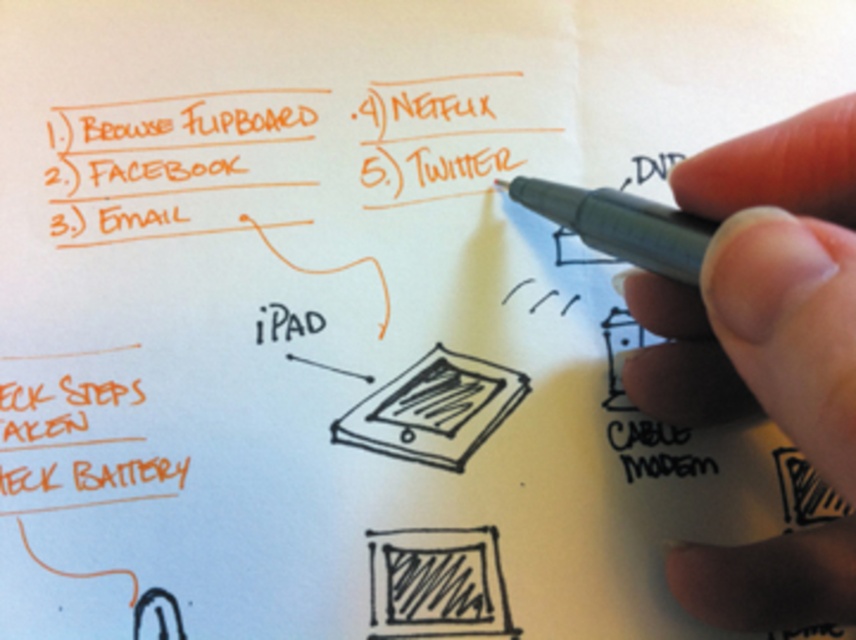
Question: Does sketchy paper tablet at center have a greater width compared to black pen at upper right?

Choices:
 (A) no
 (B) yes

Answer: (B)

Question: Does skinny pen at upper right lie behind sketchy paper tablet at center?

Choices:
 (A) yes
 (B) no

Answer: (B)

Question: Which of the following is the farthest from the observer?

Choices:
 (A) black pen at upper right
 (B) skinny pen at upper right

Answer: (A)

Question: Estimate the real-world distances between objects in this image. Which object is farther from the sketchy paper tablet at center?

Choices:
 (A) skinny pen at upper right
 (B) black pen at upper right

Answer: (A)

Question: Observing the image, what is the correct spatial positioning of skinny pen at upper right in reference to sketchy paper tablet at center?

Choices:
 (A) left
 (B) right

Answer: (B)

Question: Among these objects, which one is nearest to the camera?

Choices:
 (A) sketchy paper tablet at center
 (B) black pen at upper right

Answer: (B)